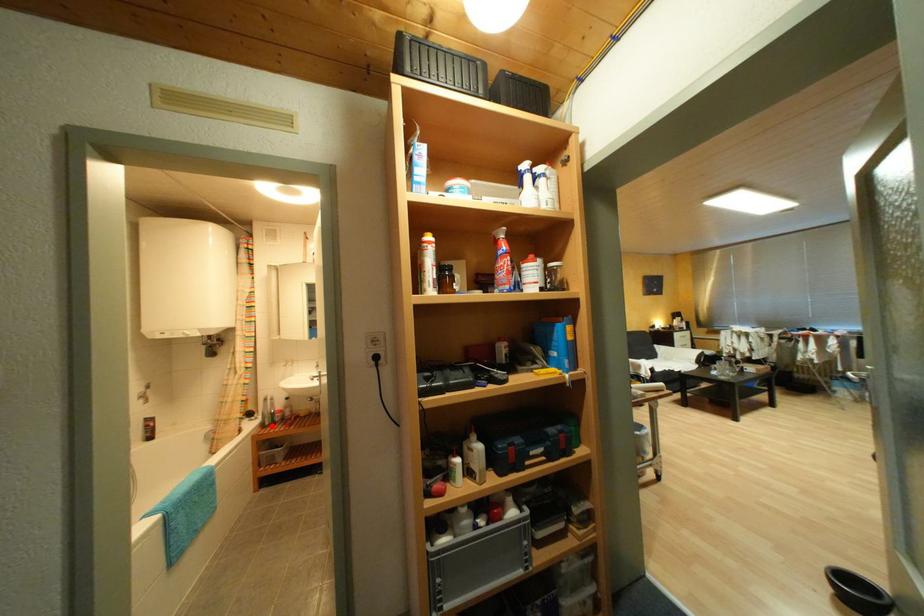
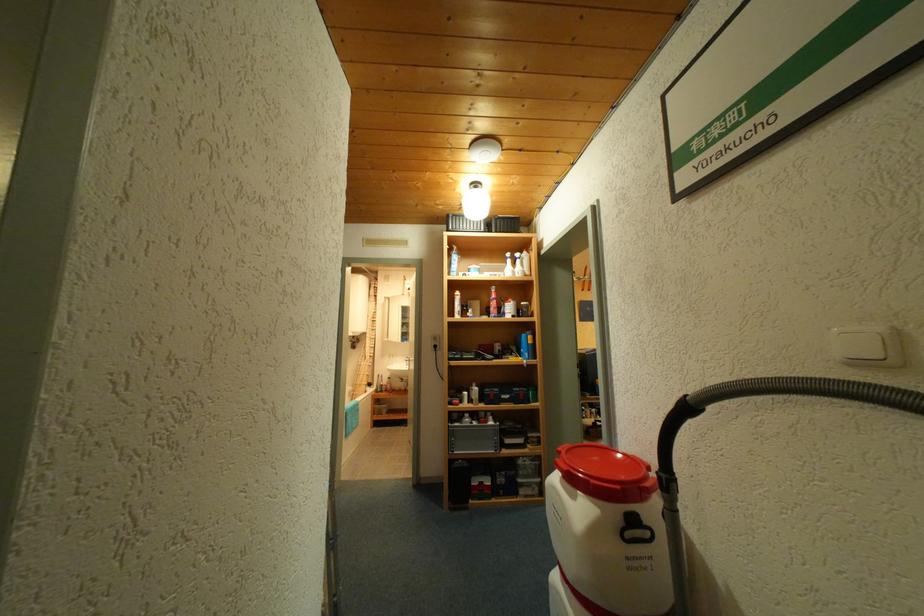
In the second image, find the point that corresponds to the highlighted location in the first image.

(385, 392)